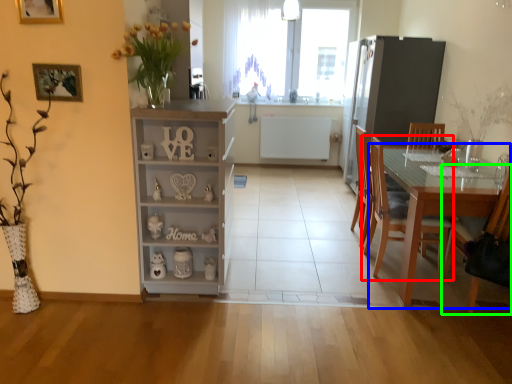
Question: Which is farther away from chair (highlighted by a red box)? table (highlighted by a blue box) or chair (highlighted by a green box)?

Choices:
 (A) table
 (B) chair

Answer: (B)